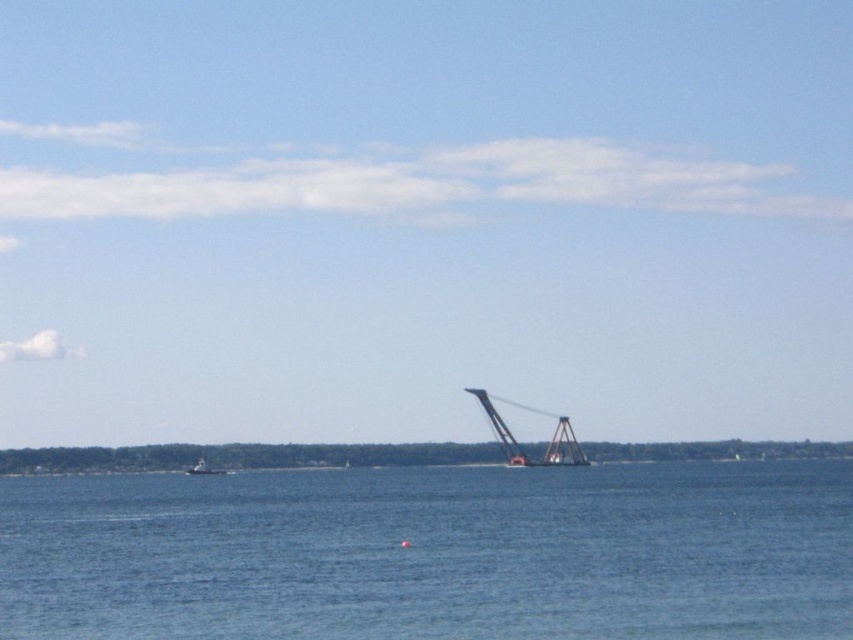
You are a photographer planning to capture a landscape shot of the blue water at center and the white matte boat at lower left. Based on the scene, which object appears larger in the photo?

The blue water at center appears much larger in the photo than the white matte boat at lower left because it is described as much taller.

Looking at this image, you are a photographer trying to capture the entire scene in one shot. Given that your camera can only focus on one object at a time, which object between the blue water at center and the metallic orange crane at center should you focus on to ensure the larger object is in focus?

The blue water at center is bigger than the metallic orange crane at center, so you should focus on the blue water at center to ensure the larger object is in focus.